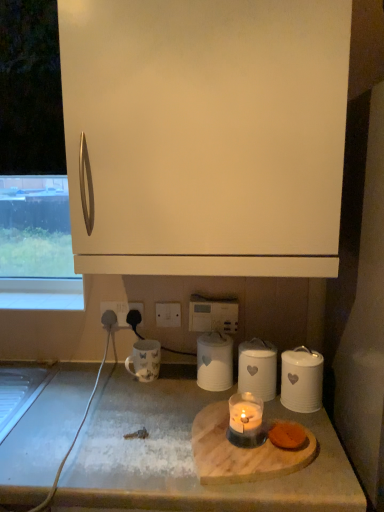
Question: Is white ceramic canister at center, which appears as the 3th kitchen appliance when viewed from the right, inside white matte cabinet at upper center?

Choices:
 (A) yes
 (B) no

Answer: (B)

Question: Is white matte cabinet at upper center not inside white ceramic canister at center, which appears as the 3th kitchen appliance when viewed from the right?

Choices:
 (A) yes
 (B) no

Answer: (A)

Question: From a real-world perspective, is white matte cabinet at upper center located higher than white ceramic canister at center, positioned as the 1th kitchen appliance in left-to-right order?

Choices:
 (A) yes
 (B) no

Answer: (A)

Question: Can you confirm if white matte cabinet at upper center is thinner than white ceramic canister at center, positioned as the 1th kitchen appliance in left-to-right order?

Choices:
 (A) no
 (B) yes

Answer: (A)

Question: Is white matte cabinet at upper center positioned before white ceramic canister at center, which appears as the 3th kitchen appliance when viewed from the right?

Choices:
 (A) yes
 (B) no

Answer: (A)

Question: From a real-world perspective, relative to white glossy mug at lower left, is white matte cabinet at upper center vertically above or below?

Choices:
 (A) below
 (B) above

Answer: (B)

Question: Considering their positions, is white matte cabinet at upper center located in front of or behind white glossy mug at lower left?

Choices:
 (A) behind
 (B) front

Answer: (B)

Question: Considering the positions of point (203, 269) and point (142, 380), is point (203, 269) closer or farther from the camera than point (142, 380)?

Choices:
 (A) closer
 (B) farther

Answer: (A)

Question: Is white matte cabinet at upper center inside the boundaries of white glossy mug at lower left, or outside?

Choices:
 (A) inside
 (B) outside

Answer: (B)

Question: Is wooden cutting board at lower center wider or thinner than white rubber cable at lower left?

Choices:
 (A) wide
 (B) thin

Answer: (B)

Question: From a real-world perspective, is wooden cutting board at lower center positioned above or below white rubber cable at lower left?

Choices:
 (A) above
 (B) below

Answer: (A)

Question: From the image's perspective, is wooden cutting board at lower center located above or below white rubber cable at lower left?

Choices:
 (A) below
 (B) above

Answer: (B)

Question: Is wooden cutting board at lower center spatially inside white rubber cable at lower left, or outside of it?

Choices:
 (A) outside
 (B) inside

Answer: (A)

Question: From the image's perspective, is translucent glass candle at center positioned above or below white ceramic canister at center, positioned as the 1th kitchen appliance in left-to-right order?

Choices:
 (A) below
 (B) above

Answer: (A)

Question: Is translucent glass candle at center wider or thinner than white ceramic canister at center, which appears as the 3th kitchen appliance when viewed from the right?

Choices:
 (A) wide
 (B) thin

Answer: (B)